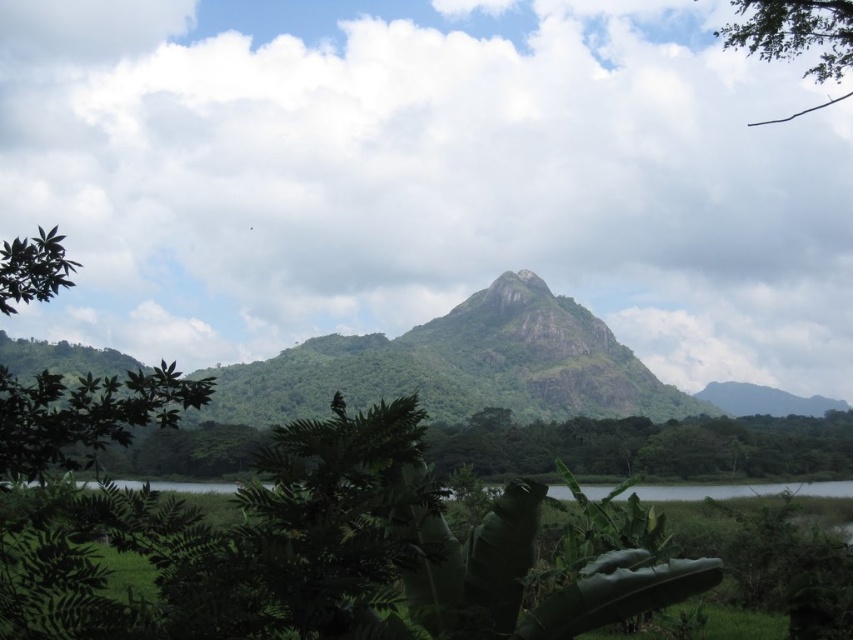
Can you confirm if green leafy tree at left is shorter than green leafy water at lower center?

No.

Is green leafy tree at left positioned before green leafy water at lower center?

Yes.

Is point (132, 417) positioned behind point (567, 490)?

No, (132, 417) is closer to viewer.

Where is `green leafy tree at left`? green leafy tree at left is located at coordinates (x=84, y=416).

Does point (532, 348) come in front of point (183, 378)?

No, it is behind (183, 378).

Can you confirm if green textured mountain at center is wider than green leafy tree at left?

Indeed, green textured mountain at center has a greater width compared to green leafy tree at left.

Does point (573, 321) lie in front of point (65, 268)?

No.

Find the location of a particular element. This screenshot has width=853, height=640. green textured mountain at center is located at coordinates (502, 401).

Between green textured mountain at center and green leafy tree at upper left, which one is positioned higher?

Positioned higher is green leafy tree at upper left.

Is point (502, 288) less distant than point (13, 310)?

No, (502, 288) is further to viewer.

The image size is (853, 640). Describe the element at coordinates (502, 401) in the screenshot. I see `green textured mountain at center` at that location.

Locate an element on the screen. This screenshot has width=853, height=640. green textured mountain at center is located at coordinates (502, 401).